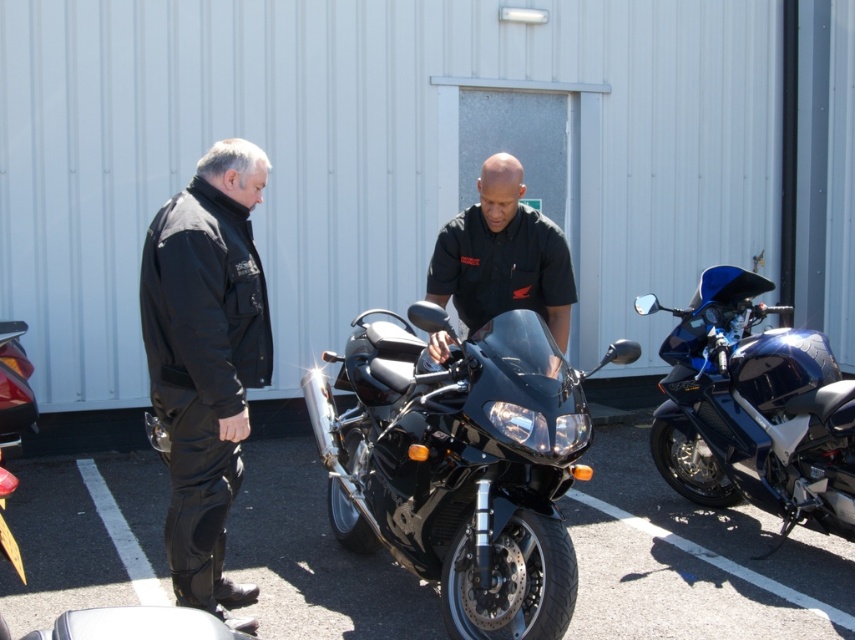
You are a photographer positioned in front of the two motorcycles. You want to take a clear photo of the black metallic motorcycle at center without the glossy blue motorcycle at right blocking it. Is this possible based on their positions?

The black metallic motorcycle at center is closer to the viewer than the glossy blue motorcycle at right, so you can take a clear photo of the black metallic motorcycle at center without the glossy blue motorcycle at right blocking it by focusing on the closer motorcycle.

You are a photographer trying to capture a shot of the black leather pants at left and the glossy blue motorcycle at right. Based on their positions, which object is closer to the left edge of the image?

The black leather pants at left are closer to the left edge of the image because they are positioned to the left of the glossy blue motorcycle at right.

Please provide the coordinates of the black leather pants at left in the image.

The coordinates of the black leather pants at left are at point (205, 360).